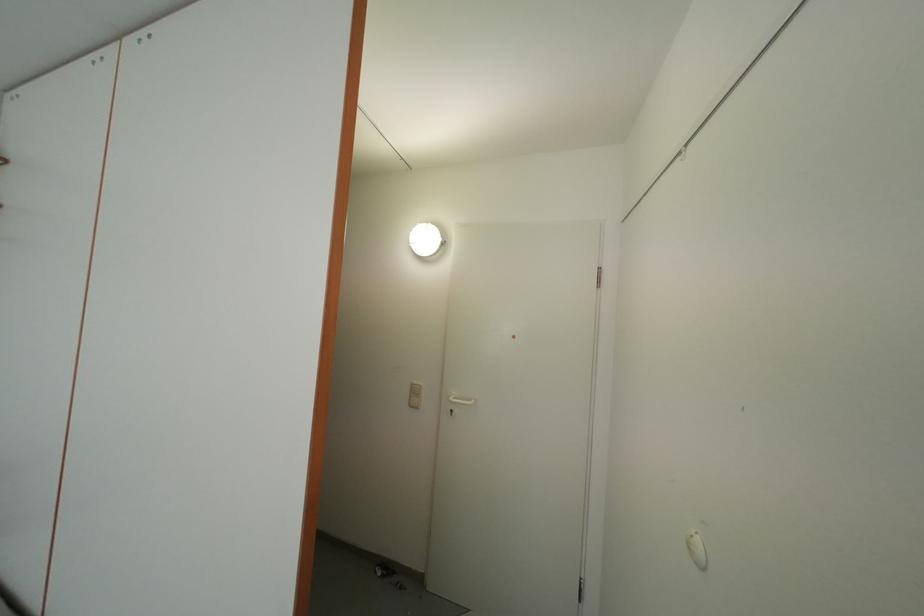
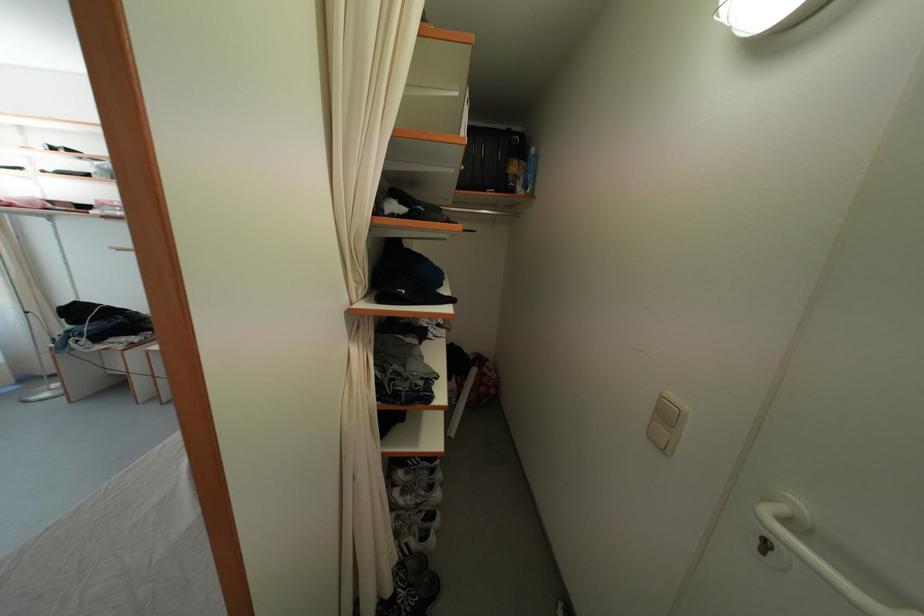
The point at [417,403] is marked in the first image. Where is the corresponding point in the second image?

(659, 426)